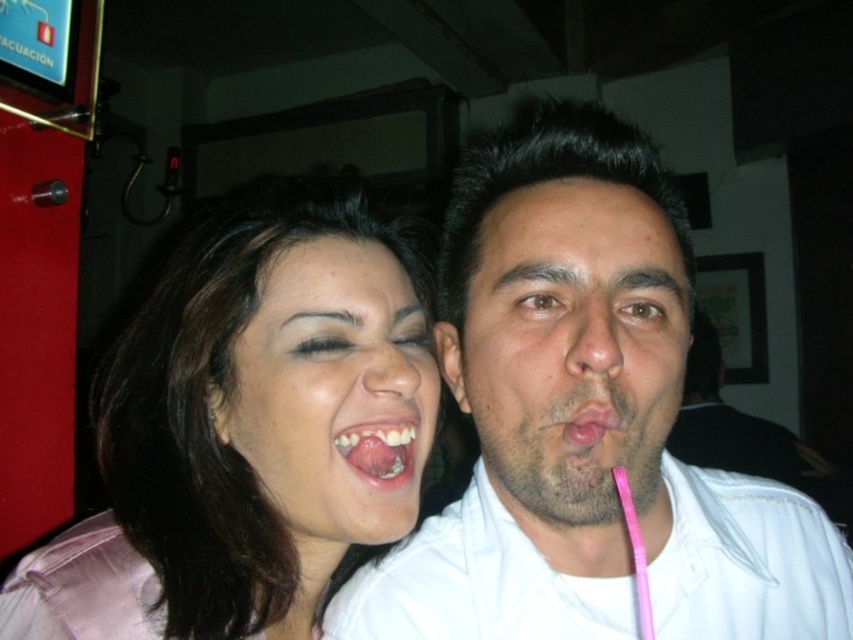
Is point (821, 584) positioned before point (358, 476)?

No, it is behind (358, 476).

The height and width of the screenshot is (640, 853). Describe the element at coordinates (602, 436) in the screenshot. I see `white matte shirt at center` at that location.

This screenshot has width=853, height=640. What do you see at coordinates (602, 436) in the screenshot? I see `white matte shirt at center` at bounding box center [602, 436].

The image size is (853, 640). I want to click on white matte shirt at center, so click(602, 436).

Which is in front, point (381, 433) or point (595, 404)?

Positioned in front is point (595, 404).

Between pink glossy tongue at center and pink matte tongue at center, which one has less height?

With less height is pink matte tongue at center.

Which is in front, point (402, 433) or point (618, 412)?

Positioned in front is point (618, 412).

Find the location of a particular element. This screenshot has height=640, width=853. pink glossy tongue at center is located at coordinates (379, 449).

Is white matte shirt at center above smooth skin face at center?

Incorrect, white matte shirt at center is not positioned above smooth skin face at center.

Which is more to the right, white matte shirt at center or smooth skin face at center?

Positioned to the right is white matte shirt at center.

Where is `white matte shirt at center`? white matte shirt at center is located at coordinates (602, 436).